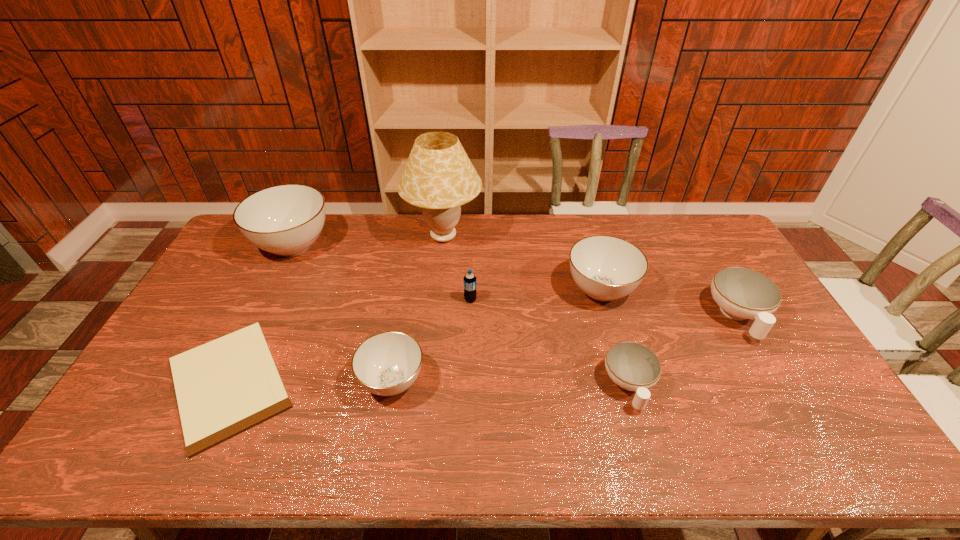
Find the location of a particular element. This screenshot has height=540, width=960. free space at the far edge of the desktop is located at coordinates (531, 222).

In order to click on vacant point at the near edge in this screenshot , I will do [x=302, y=431].

This screenshot has height=540, width=960. In the image, there is a desktop. Find the location of `vacant space at the left edge`. vacant space at the left edge is located at coordinates (210, 278).

Image resolution: width=960 pixels, height=540 pixels. In the image, there is a desktop. Identify the location of vacant space at the right edge. (769, 350).

I want to click on blank region between the lampshade and the soda bottle, so click(457, 268).

The image size is (960, 540). What are the coordinates of `free space between the rightmost gray chinaware and the right white chinaware` in the screenshot? It's located at (669, 303).

Identify the location of vacant area between the shortest object and the farther white chinaware. This screenshot has width=960, height=540. point(484,349).

You are a GUI agent. You are given a task and a screenshot of the screen. Output one action in this format:
    pyautogui.click(x=<x>, y=<y>)
    Task: Click on the vacant area that lies between the leftmost chinaware and the second biggest gray chinaware
    This screenshot has height=540, width=960.
    Given the screenshot: What is the action you would take?
    pyautogui.click(x=447, y=267)

I want to click on vacant space that is in between the fourth chinaware from right to left and the tallest chinaware, so click(343, 313).

The height and width of the screenshot is (540, 960). I want to click on vacant region between the bigger white chinaware and the shortest object, so click(484, 349).